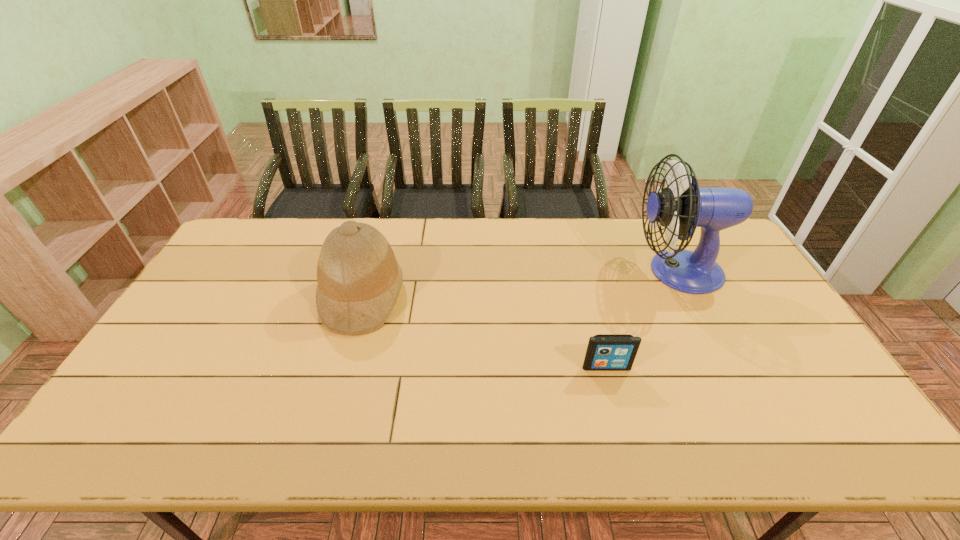
You are a GUI agent. You are given a task and a screenshot of the screen. Output one action in this format:
    pyautogui.click(x=<x>, y=<y>)
    Task: Click on the free location located 0.070m on the front screen of the second object from right to left
    
    Given the screenshot: What is the action you would take?
    pyautogui.click(x=613, y=394)

Find the location of a particular element. This screenshot has width=960, height=540. object that is positioned at the far edge is located at coordinates (680, 207).

This screenshot has width=960, height=540. Find the location of `object that is at the right edge`. object that is at the right edge is located at coordinates (680, 207).

This screenshot has height=540, width=960. Identify the location of object that is at the far right corner. (680, 207).

Locate an element on the screen. This screenshot has height=540, width=960. free region at the far edge is located at coordinates (623, 223).

In the image, there is a desktop. Where is `vacant space at the near edge`? vacant space at the near edge is located at coordinates (715, 449).

In the image, there is a desktop. Where is `vacant space at the left edge`? This screenshot has height=540, width=960. vacant space at the left edge is located at coordinates (234, 287).

This screenshot has width=960, height=540. What are the coordinates of `vacant area at the right edge` in the screenshot? It's located at (813, 377).

Locate an element on the screen. The height and width of the screenshot is (540, 960). vacant space at the far right corner of the desktop is located at coordinates (736, 250).

You are a GUI agent. You are given a task and a screenshot of the screen. Output one action in this format:
    pyautogui.click(x=<x>, y=<y>)
    Task: Click on the free spot between the hat and the rightmost object
    
    Given the screenshot: What is the action you would take?
    pyautogui.click(x=520, y=284)